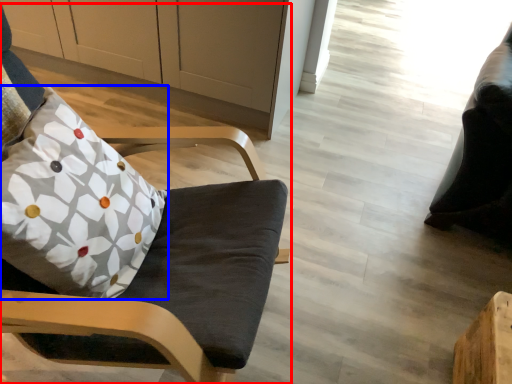
Question: Among these objects, which one is nearest to the camera, chair (highlighted by a red box) or pillow (highlighted by a blue box)?

Choices:
 (A) chair
 (B) pillow

Answer: (A)